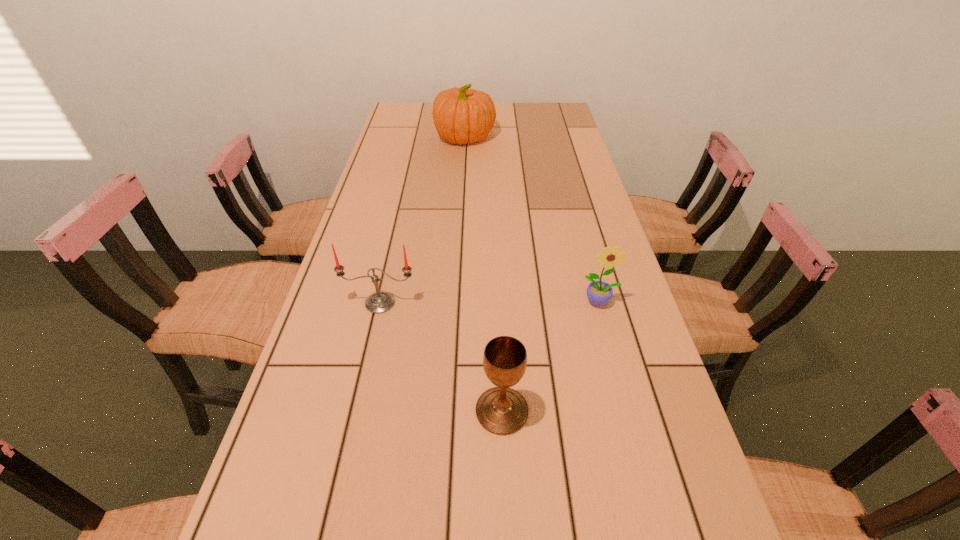
You are a GUI agent. You are given a task and a screenshot of the screen. Output one action in this format:
    pyautogui.click(x=<x>, y=<y>)
    Task: Click on the vacant space that satisfies the following two spatial constraints: 1. on the back side of the chalice; 2. on the surface of the farthest object
    
    Given the screenshot: What is the action you would take?
    pyautogui.click(x=491, y=137)

I want to click on vacant area that satisfies the following two spatial constraints: 1. on the surface of the chalice; 2. on the left side of the pumpkin, so click(449, 411).

The height and width of the screenshot is (540, 960). Identify the location of free space in the image that satisfies the following two spatial constraints: 1. on the back side of the chalice; 2. on the surface of the farthest object. (491, 137).

Locate an element on the screen. Image resolution: width=960 pixels, height=540 pixels. free space that satisfies the following two spatial constraints: 1. on the surface of the pumpkin; 2. on the front-facing side of the candle is located at coordinates (456, 303).